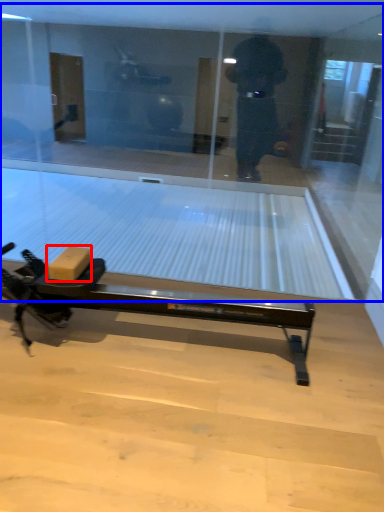
Question: Which object is further to the camera taking this photo, cardboard box (highlighted by a red box) or shop window (highlighted by a blue box)?

Choices:
 (A) cardboard box
 (B) shop window

Answer: (B)